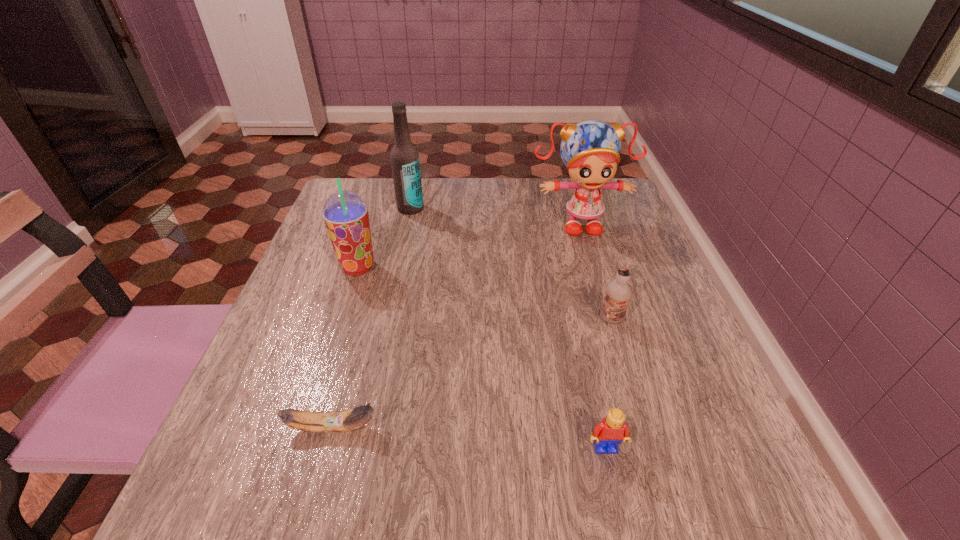
This screenshot has height=540, width=960. In order to click on vacant space situated on the face of the doll in this screenshot , I will do point(589,258).

This screenshot has height=540, width=960. Identify the location of free space located on the front of the smoothie. (343, 314).

Identify the location of free space located 0.340m on the back of the chocolate milk. (580, 217).

The height and width of the screenshot is (540, 960). In order to click on vacant region located on the front-facing side of the Lego in this screenshot , I will do `click(618, 505)`.

Identify the location of blank space located on the peel of the banana. This screenshot has height=540, width=960. (593, 428).

At what (x,y) coordinates should I click in order to perform the action: click on beer bottle at the far edge. Please return your answer as a coordinate pair (x, y). The width and height of the screenshot is (960, 540). Looking at the image, I should click on (404, 157).

This screenshot has height=540, width=960. Identify the location of doll located in the far edge section of the desktop. (590, 150).

Identify the location of smoothie that is at the left edge. This screenshot has width=960, height=540. (345, 214).

You are a GUI agent. You are given a task and a screenshot of the screen. Output one action in this format:
    pyautogui.click(x=<x>, y=<y>)
    Task: Click on the banana at the left edge
    This screenshot has height=540, width=960.
    Given the screenshot: What is the action you would take?
    pyautogui.click(x=337, y=421)

I want to click on doll at the right edge, so click(590, 150).